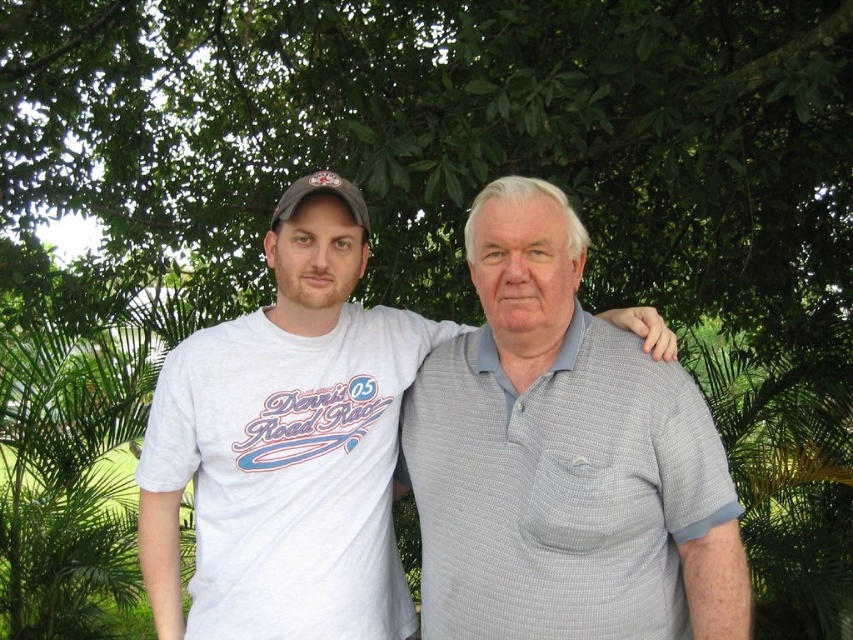
Which is behind, point (320, 342) or point (363, 205)?

Point (320, 342)

Can you confirm if white cotton t-shirt at left is positioned to the left of matte gray baseball cap at left?

Yes, white cotton t-shirt at left is to the left of matte gray baseball cap at left.

At what (x,y) coordinates should I click in order to perform the action: click on white cotton t-shirt at left. Please return your answer as a coordinate pair (x, y). Looking at the image, I should click on (283, 452).

At what (x,y) coordinates should I click in order to perform the action: click on white cotton t-shirt at left. Please return your answer as a coordinate pair (x, y). Looking at the image, I should click on (283, 452).

The height and width of the screenshot is (640, 853). Find the location of `gray textured polo shirt at center`. gray textured polo shirt at center is located at coordinates (563, 458).

Between point (601, 634) and point (289, 212), which one is positioned in front?

Point (601, 634) is more forward.

Who is more forward, [589,460] or [309,188]?

Point [589,460]

Locate an element on the screen. gray textured polo shirt at center is located at coordinates (563, 458).

Is gray textured polo shirt at center closer to camera compared to white cotton t-shirt at left?

Yes, gray textured polo shirt at center is in front of white cotton t-shirt at left.

Which of these two, gray textured polo shirt at center or white cotton t-shirt at left, stands taller?

With more height is white cotton t-shirt at left.

What are the coordinates of `gray textured polo shirt at center` in the screenshot? It's located at pyautogui.click(x=563, y=458).